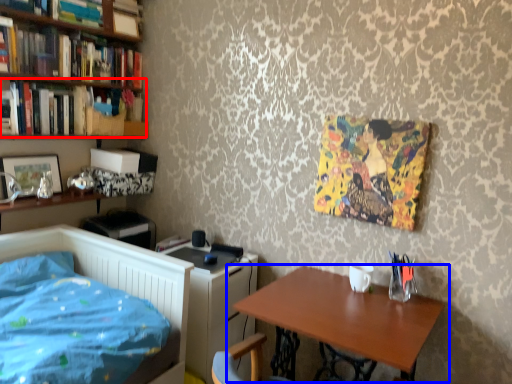
Question: Among these objects, which one is nearest to the camera, book (highlighted by a red box) or table (highlighted by a blue box)?

Choices:
 (A) book
 (B) table

Answer: (B)